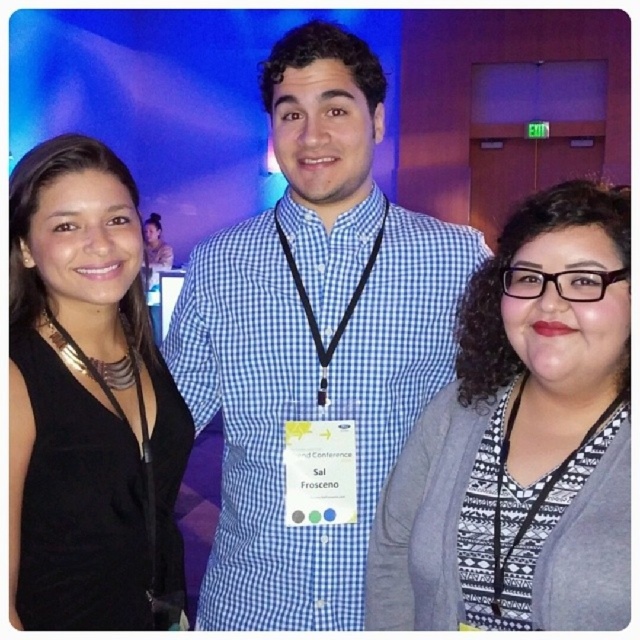
Question: Does blue checkered shirt at center have a lesser width compared to black matte dress at left?

Choices:
 (A) no
 (B) yes

Answer: (A)

Question: Which point is farther to the camera?

Choices:
 (A) blue checkered shirt at center
 (B) metallic/black lanyard at left
 (C) black fabric lanyard at center
 (D) metallic necklace at left

Answer: (C)

Question: Is blue checkered shirt at center closer to camera compared to black matte dress at left?

Choices:
 (A) yes
 (B) no

Answer: (B)

Question: Does blue checkered shirt at center appear over black fabric lanyard at lower right?

Choices:
 (A) no
 (B) yes

Answer: (B)

Question: Which point is farther to the camera?

Choices:
 (A) metallic necklace at left
 (B) black fabric lanyard at center
 (C) black matte dress at left

Answer: (B)

Question: Among these points, which one is farthest from the camera?

Choices:
 (A) tap(500, 500)
 (B) tap(38, 321)

Answer: (B)